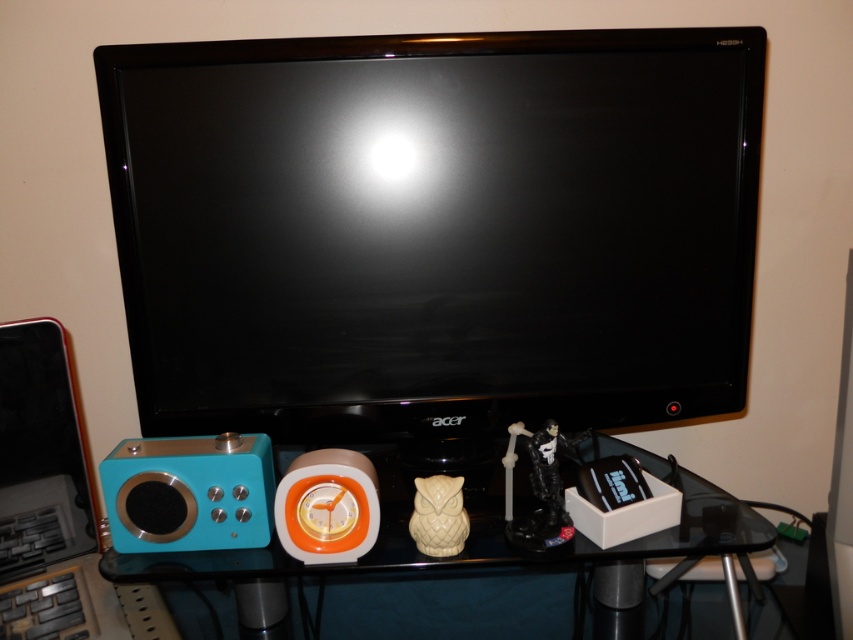
Question: Does translucent glass shelf at center come behind teal plastic speaker at lower left?

Choices:
 (A) yes
 (B) no

Answer: (B)

Question: Which point appears farthest from the camera in this image?

Choices:
 (A) (489, 88)
 (B) (445, 564)
 (C) (140, 497)

Answer: (A)

Question: Among these points, which one is nearest to the camera?

Choices:
 (A) (129, 68)
 (B) (250, 566)

Answer: (B)

Question: Which object is positioned closest to the translucent glass shelf at center?

Choices:
 (A) black glossy monitor at center
 (B) teal plastic speaker at lower left

Answer: (B)

Question: Is black glossy monitor at center closer to the viewer compared to teal plastic speaker at lower left?

Choices:
 (A) no
 (B) yes

Answer: (A)

Question: Is black glossy monitor at center positioned at the back of teal plastic speaker at lower left?

Choices:
 (A) yes
 (B) no

Answer: (A)